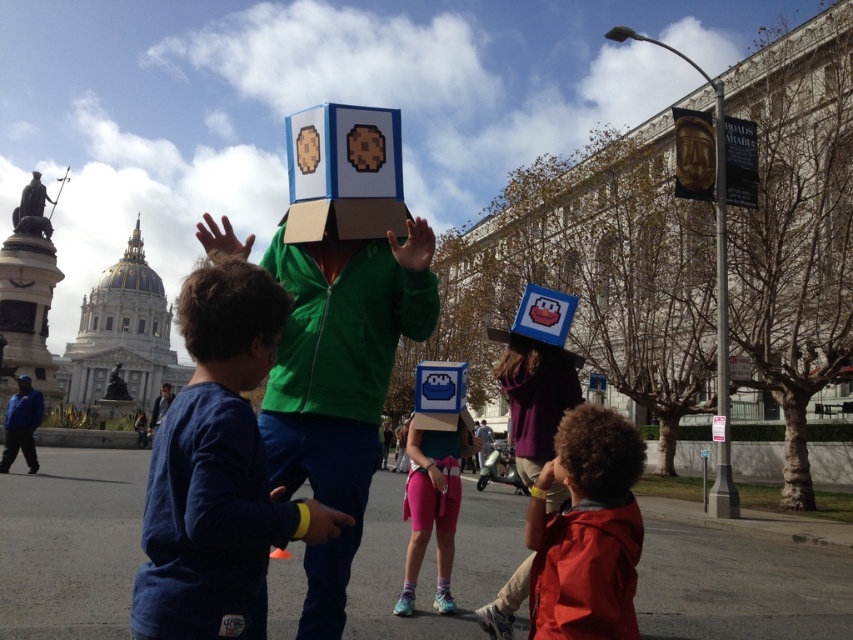
Question: Which object is the closest to the blue cotton shirt at center?

Choices:
 (A) matte green jacket at center
 (B) matte blue helmet at center
 (C) matte red jacket at lower right

Answer: (A)

Question: Which point is closer to the camera?

Choices:
 (A) matte blue helmet at center
 (B) curly brown hair at lower right

Answer: (B)

Question: Is matte red jacket at lower right further to camera compared to matte blue helmet at center?

Choices:
 (A) yes
 (B) no

Answer: (B)

Question: Is the position of matte red jacket at lower right more distant than that of matte blue helmet at center?

Choices:
 (A) yes
 (B) no

Answer: (B)

Question: Can you confirm if matte green jacket at center is positioned to the left of curly brown hair at lower right?

Choices:
 (A) yes
 (B) no

Answer: (A)

Question: Which point is farther to the camera?

Choices:
 (A) curly brown hair at lower right
 (B) matte blue helmet at center
 (C) blue cotton shirt at center

Answer: (B)